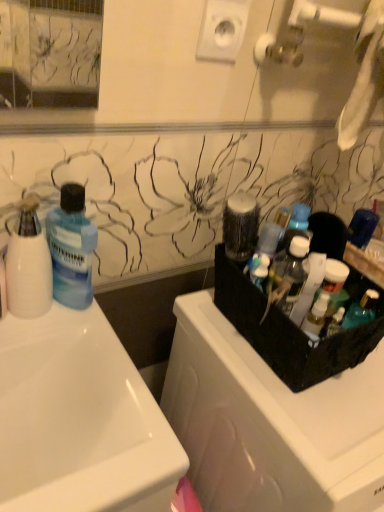
This screenshot has width=384, height=512. I want to click on free spot above white glossy sink at left (from a real-world perspective), so click(x=97, y=355).